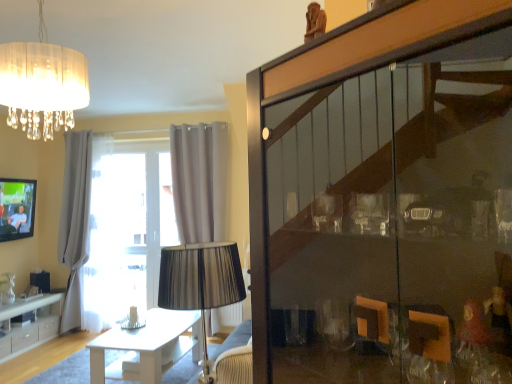
Image resolution: width=512 pixels, height=384 pixels. I want to click on free point above white glossy table at center (from a real-world perspective), so [x=146, y=329].